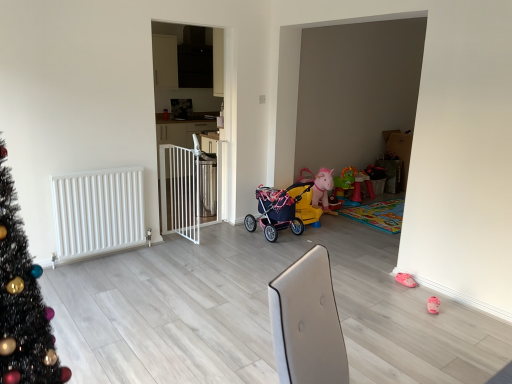
Identify the location of free space in front of white matte radiator at left. This screenshot has height=384, width=512. pyautogui.click(x=87, y=277).